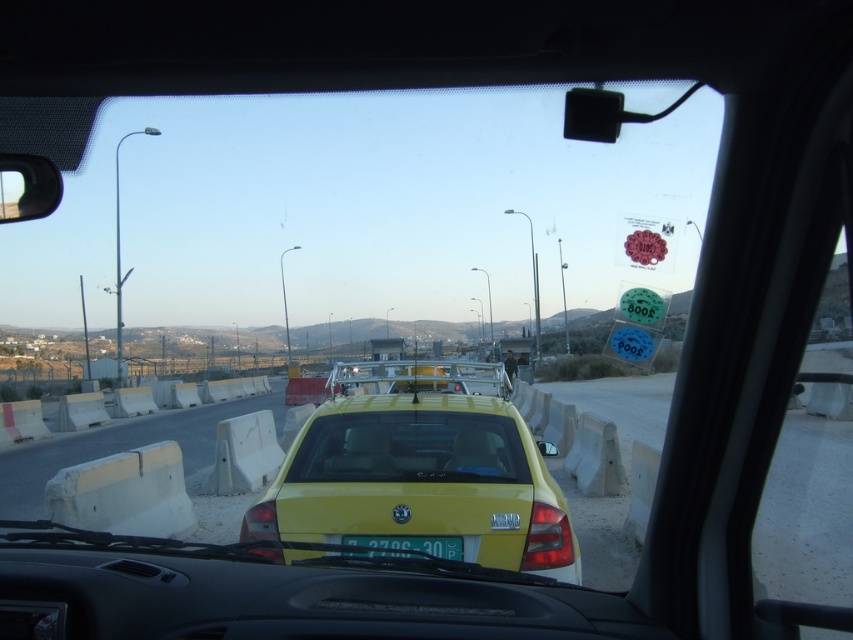
Which is in front, point (456, 458) or point (450, 557)?

Point (450, 557) is more forward.

The image size is (853, 640). In order to click on transparent glass windshield at center in this screenshot , I will do `click(410, 449)`.

Does yellow matte taxi at center have a lesser height compared to transparent glass windshield at center?

Incorrect, yellow matte taxi at center's height does not fall short of transparent glass windshield at center's.

Is yellow matte taxi at center smaller than transparent glass windshield at center?

Actually, yellow matte taxi at center might be larger than transparent glass windshield at center.

Locate an element on the screen. yellow matte taxi at center is located at coordinates (421, 468).

Where is `yellow matte taxi at center`? The height and width of the screenshot is (640, 853). yellow matte taxi at center is located at coordinates (421, 468).

Which is more to the left, yellow matte taxi at center or yellow plastic license plate at center?

yellow plastic license plate at center

Consider the image. Does yellow matte taxi at center appear over yellow plastic license plate at center?

Yes.

The width and height of the screenshot is (853, 640). In order to click on yellow matte taxi at center in this screenshot , I will do `click(421, 468)`.